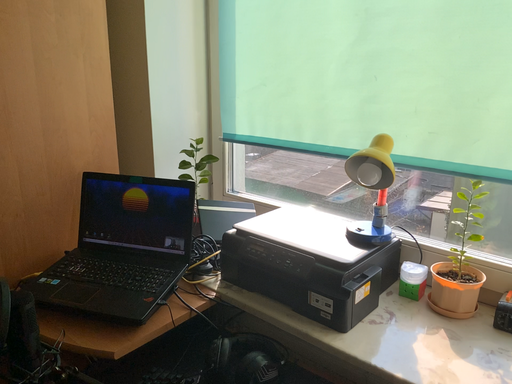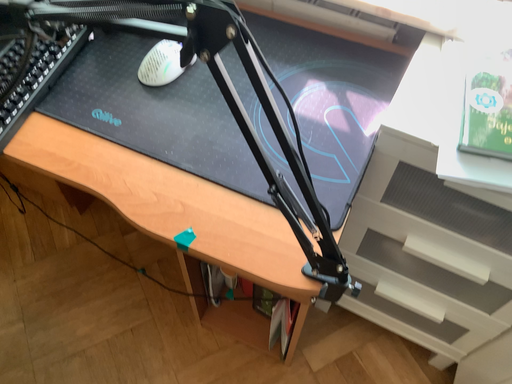
Question: Which way did the camera rotate in the video?

Choices:
 (A) rotated left
 (B) rotated right

Answer: (B)